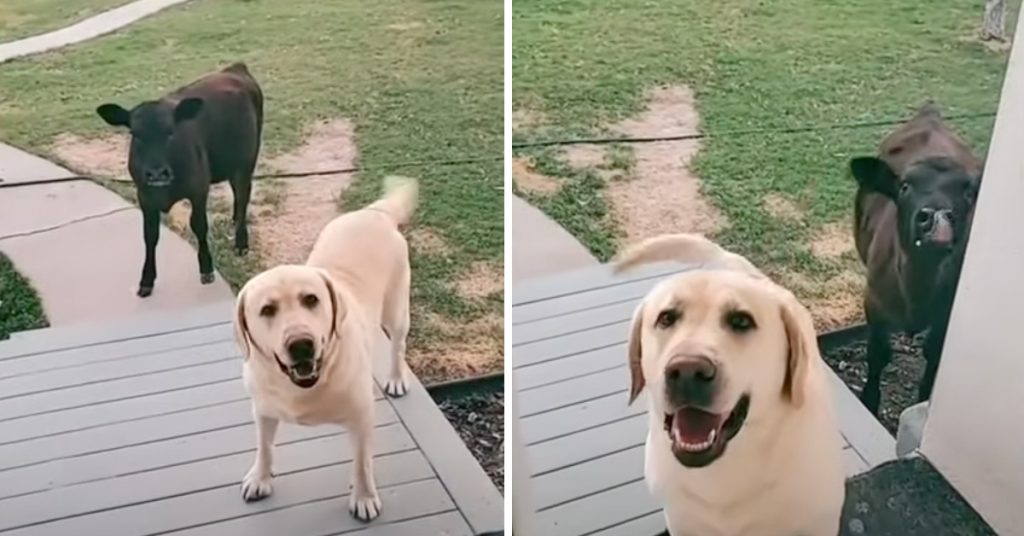
Locate an element on the screen. light gray platform with small staircase is located at coordinates (190, 418), (590, 412), (560, 281), (147, 322).